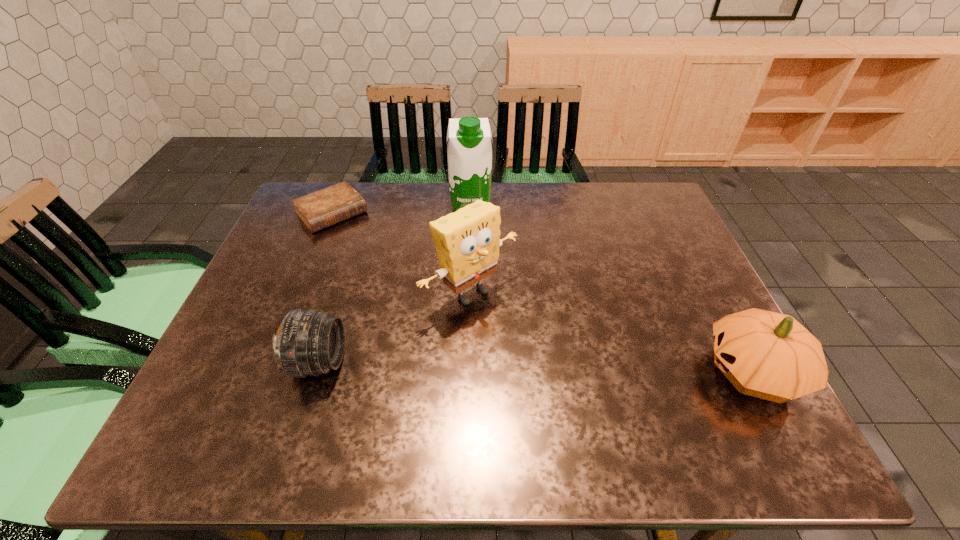
The height and width of the screenshot is (540, 960). I want to click on blank space at the left edge of the desktop, so click(296, 228).

In the image, there is a desktop. Where is `vacant space at the right edge`? The width and height of the screenshot is (960, 540). vacant space at the right edge is located at coordinates (684, 346).

Locate an element on the screen. The height and width of the screenshot is (540, 960). vacant space at the far left corner of the desktop is located at coordinates (309, 193).

In the image, there is a desktop. Identify the location of vacant space at the far right corner. [630, 225].

Locate an element on the screen. unoccupied position between the diary and the sponge is located at coordinates (401, 253).

Where is `empty space between the soya milk and the telephoto lens`? The image size is (960, 540). empty space between the soya milk and the telephoto lens is located at coordinates (395, 285).

At what (x,y) coordinates should I click in order to perform the action: click on free space between the tallest object and the shortest object. Please return your answer as a coordinate pair (x, y). This screenshot has width=960, height=540. Looking at the image, I should click on (401, 210).

What are the coordinates of `free space that is in between the sponge and the diary` in the screenshot? It's located at (401, 253).

Where is `empty space that is in between the shortest object and the third shortest object`? The width and height of the screenshot is (960, 540). empty space that is in between the shortest object and the third shortest object is located at coordinates (542, 293).

In order to click on vacant region between the shortest object and the second shortest object in this screenshot , I will do `click(325, 288)`.